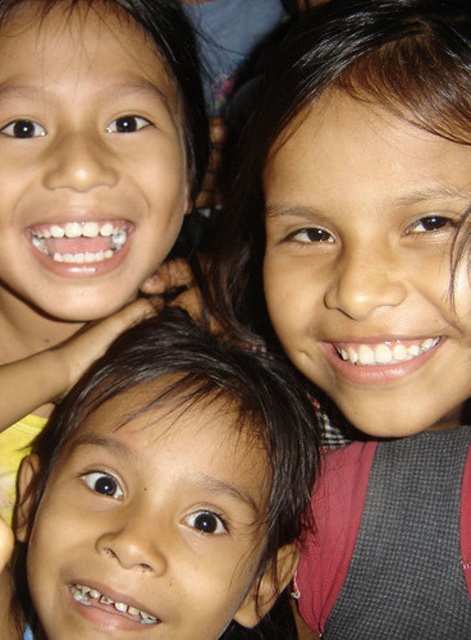
You are a photographer adjusting the camera focus. You need to ensure that both the smooth skin face at upper right and the brown hair at center are in focus. Given their height difference, which subject should you focus on first to achieve proper depth of field?

The smooth skin face at upper right is much taller than the brown hair at center, so you should focus on the smooth skin face at upper right first to ensure both are in focus.

You are a photographer standing 40 inches away from the scene. You want to adjust your position so that the point at coordinates point (238, 291) becomes exactly 40 inches away from you. Should you move closer or farther away?

The point at coordinates point (238, 291) is currently 38.21 inches away from the viewer. Since you want it to be 40 inches away, you should move farther away by approximately 1.79 inches.